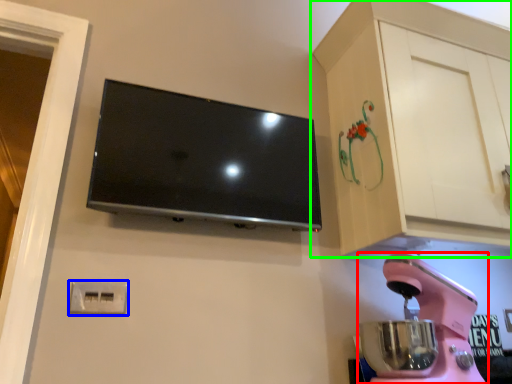
Question: Which is farther away from home appliance (highlighted by a red box)? electric outlet (highlighted by a blue box) or cabinetry (highlighted by a green box)?

Choices:
 (A) electric outlet
 (B) cabinetry

Answer: (A)